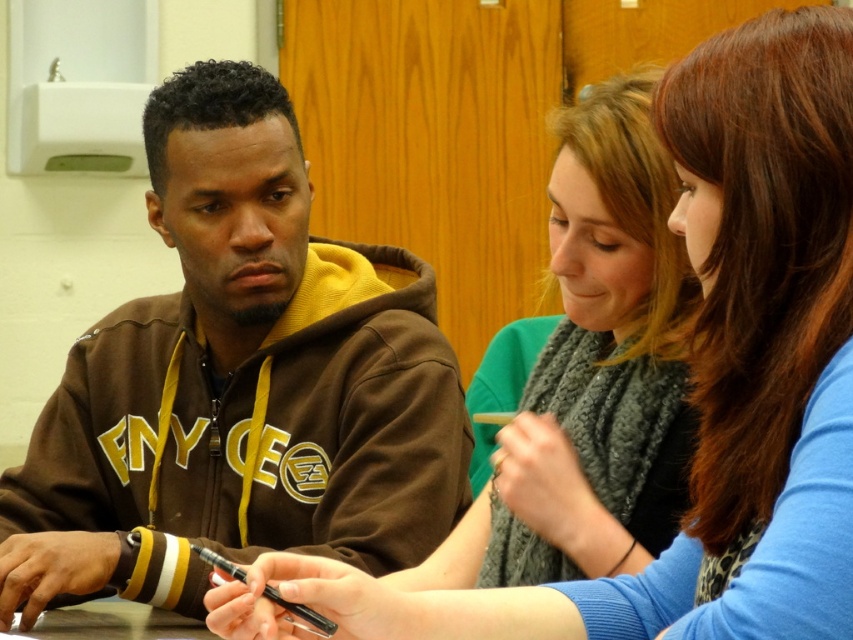
Between brown fleece hoodie at left and matte green sweater at center, which one is positioned higher?

brown fleece hoodie at left is above.

Based on the photo, can you confirm if brown fleece hoodie at left is positioned below matte green sweater at center?

No, brown fleece hoodie at left is not below matte green sweater at center.

Is point (376, 259) positioned after point (729, 221)?

Yes, point (376, 259) is farther from viewer.

Locate an element on the screen. brown fleece hoodie at left is located at coordinates pos(236,385).